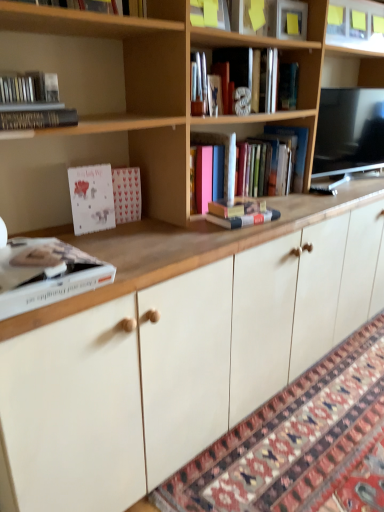
Question: Considering the relative sizes of hardcover book at center, which is the 4th book from left to right, and white matte book at lower left, acting as the 5th book starting from the right, in the image provided, is hardcover book at center, which is the 4th book from left to right, shorter than white matte book at lower left, acting as the 5th book starting from the right,?

Choices:
 (A) yes
 (B) no

Answer: (B)

Question: From the image's perspective, does hardcover book at center, which is the 4th book from left to right, appear higher than white matte book at lower left, acting as the 5th book starting from the right?

Choices:
 (A) no
 (B) yes

Answer: (B)

Question: Is hardcover book at center, which is the 4th book from left to right, closer to camera compared to white matte book at lower left, which is the third book from left to right?

Choices:
 (A) no
 (B) yes

Answer: (A)

Question: Is hardcover book at center, which is the 4th book from left to right, not within white matte book at lower left, acting as the 5th book starting from the right?

Choices:
 (A) no
 (B) yes

Answer: (B)

Question: Does hardcover book at center, acting as the fourth book starting from the right, have a smaller size compared to white matte book at lower left, which is the third book from left to right?

Choices:
 (A) no
 (B) yes

Answer: (A)

Question: From a real-world perspective, is hardcover book at center, which is the 4th book from left to right, on white matte book at lower left, acting as the 5th book starting from the right?

Choices:
 (A) no
 (B) yes

Answer: (B)

Question: From a real-world perspective, is metallic silver letter at upper center, the 6th book from the left, positioned under hardcover book at center, which is the third book from right to left, based on gravity?

Choices:
 (A) no
 (B) yes

Answer: (A)

Question: From the image's perspective, does metallic silver letter at upper center, the 6th book from the left, appear lower than hardcover book at center, which is the third book from right to left?

Choices:
 (A) yes
 (B) no

Answer: (B)

Question: Is metallic silver letter at upper center, the 6th book from the left, bigger than hardcover book at center, the 5th book positioned from the left?

Choices:
 (A) no
 (B) yes

Answer: (B)

Question: Is metallic silver letter at upper center, the 6th book from the left, shorter than hardcover book at center, which is the third book from right to left?

Choices:
 (A) yes
 (B) no

Answer: (B)

Question: Can you confirm if metallic silver letter at upper center, the 6th book from the left, is wider than hardcover book at center, which is the third book from right to left?

Choices:
 (A) yes
 (B) no

Answer: (A)

Question: Considering the relative positions of metallic silver letter at upper center, the 6th book from the left, and hardcover book at center, which is the third book from right to left, in the image provided, is metallic silver letter at upper center, the 6th book from the left, in front of hardcover book at center, which is the third book from right to left,?

Choices:
 (A) yes
 (B) no

Answer: (B)

Question: Is hardcover book at upper left, the sixth book when ordered from right to left, at the back of wooden bookcase at upper center?

Choices:
 (A) no
 (B) yes

Answer: (A)